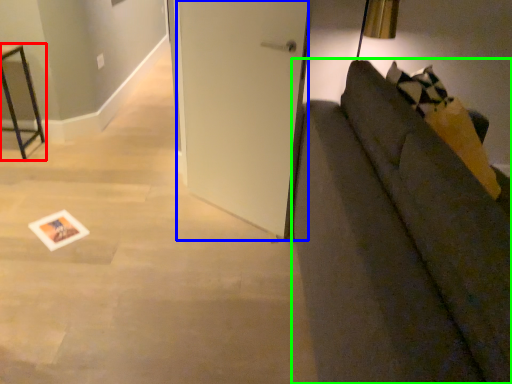
Question: Which object is the closest to the furniture (highlighted by a red box)? Choose among these: door (highlighted by a blue box) or studio couch (highlighted by a green box).

Choices:
 (A) door
 (B) studio couch

Answer: (A)